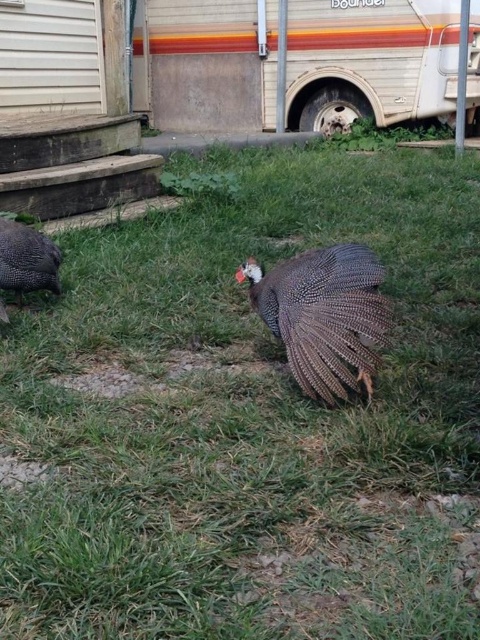
You are planning to take a photo of the rustic wood recreational vehicle at center and the brown speckled turkey at left. To ensure both are in frame, which object should you position closer to the camera?

You should position the brown speckled turkey at left closer to the camera because the rustic wood recreational vehicle at center is larger in size and will take up more space in the frame.

You are standing in the grassy area and see the brown speckled turkey at left and the brown speckled feathers at center. If you want to pick up the feathers, which direction should you walk to reach them first?

The brown speckled feathers at center are to the right of the brown speckled turkey at left. So you should walk to the right to reach the feathers first.